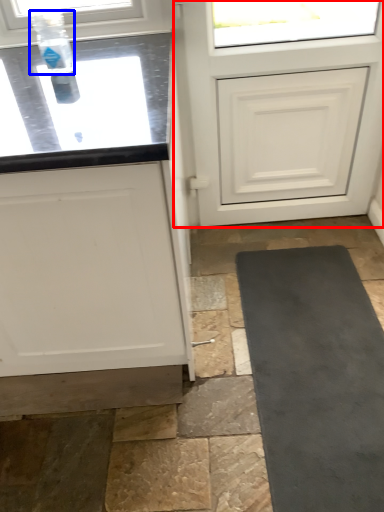
Question: Which point is closer to the camera, door (highlighted by a red box) or bottle (highlighted by a blue box)?

Choices:
 (A) door
 (B) bottle

Answer: (B)